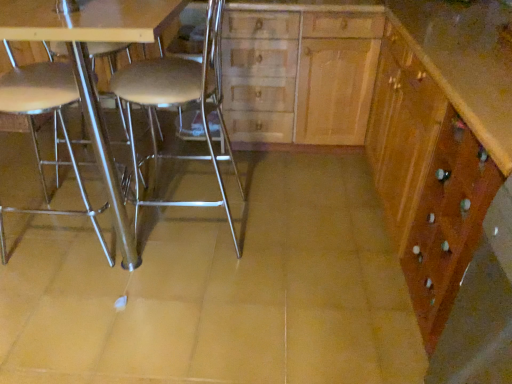
Identify the location of vacant area that lies to the right of metallic silver stool at center, placed as the 2th chair when sorted from left to right. Image resolution: width=512 pixels, height=384 pixels. (294, 240).